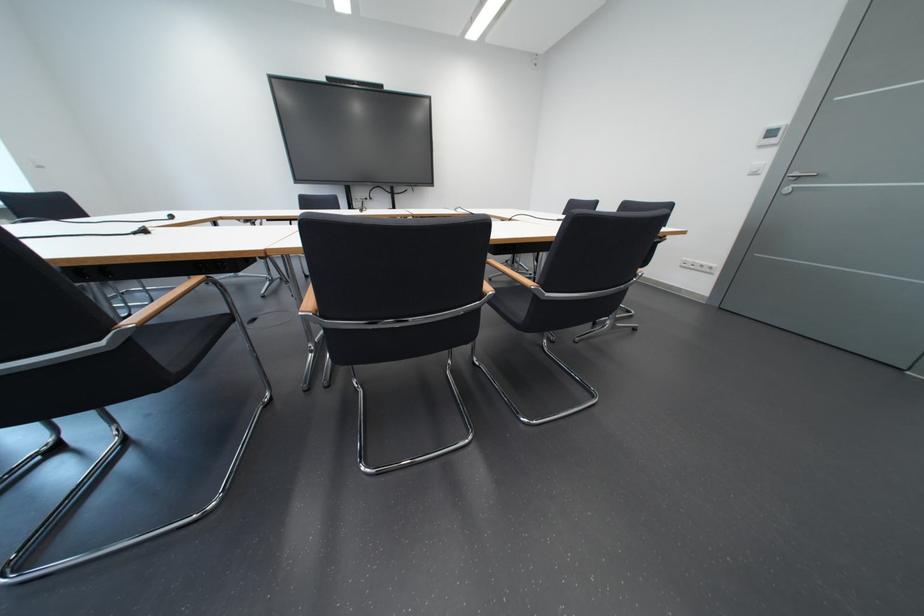
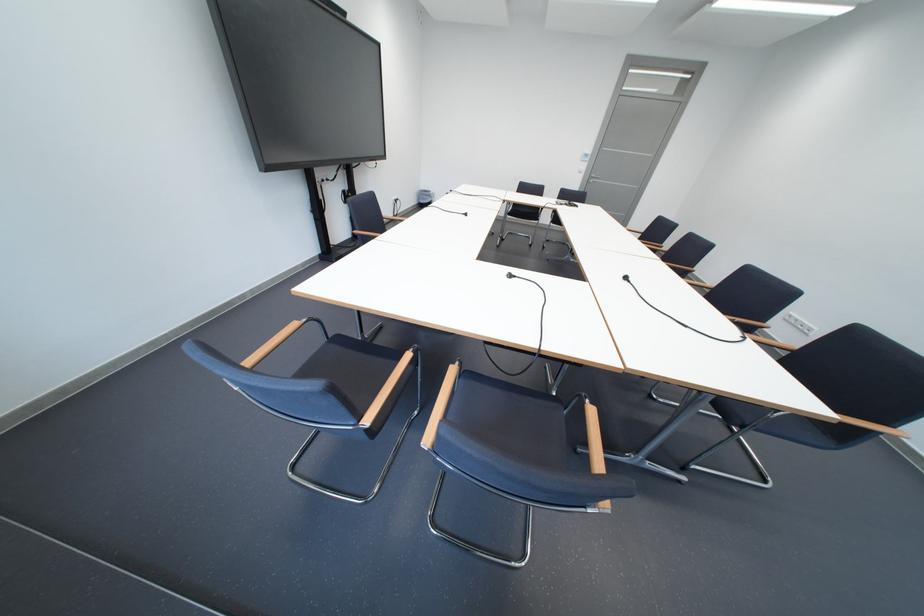
The point at (776,160) is marked in the first image. Where is the corresponding point in the second image?

(596, 168)